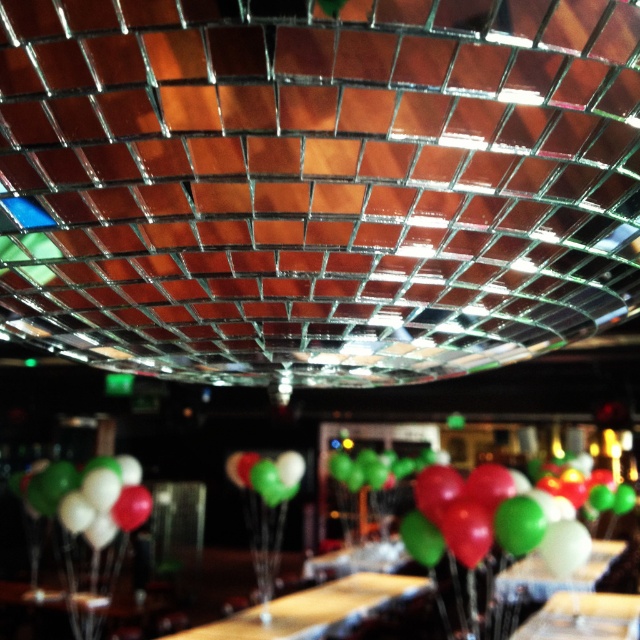
You are at a party and want to take a photo of the green glossy balloon at lower center without the green matte balloon at center appearing in the background. Is this possible given their positions?

The green glossy balloon at lower center is in front of the green matte balloon at center, so taking a photo of the green glossy balloon at lower center without the green matte balloon at center in the background would require adjusting the angle or moving the glossy balloon to ensure the matte one is not behind it. However, since the glossy balloon is already in front, you might still see the matte one unless they are separated spatially.

Consider the image. You are standing at the position of the photographer who took the image. There are two points marked in the scene, point A at point (132, 477) and point B at point (266, 493). Which point is closer to you?

Point A at point (132, 477) is closer to you because it is in front of point B at point (266, 493).